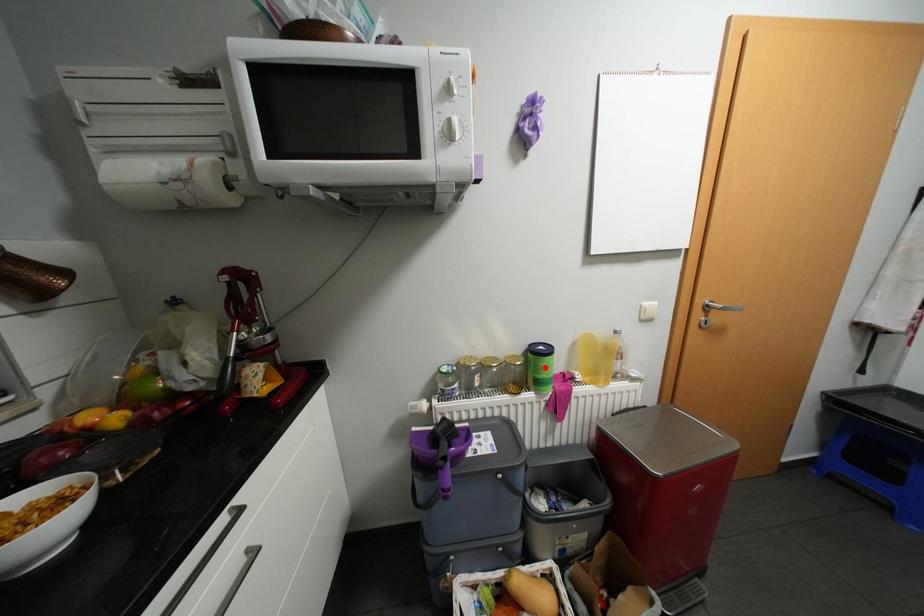
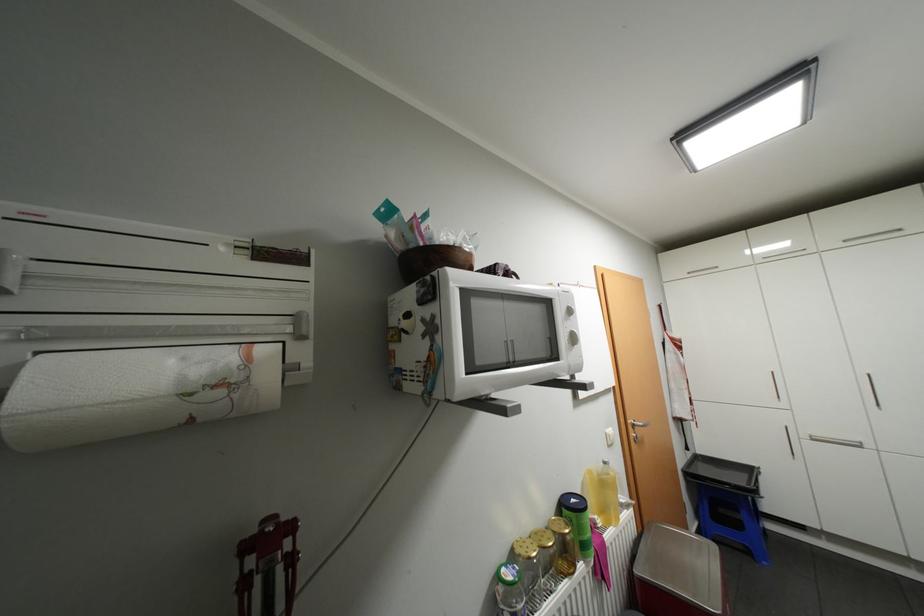
Locate, in the second image, the point that corresponds to the highlighted location in the first image.

(589, 528)